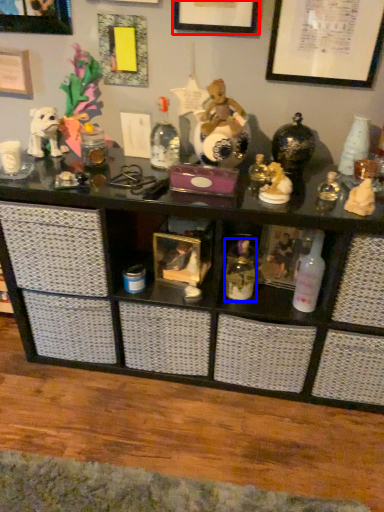
Question: Among these objects, which one is nearest to the camera, picture frame (highlighted by a red box) or toiletry (highlighted by a blue box)?

Choices:
 (A) picture frame
 (B) toiletry

Answer: (A)